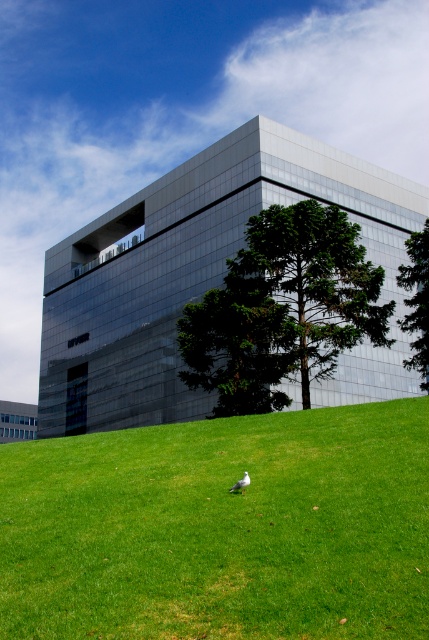
Is green grassy at lower center behind green leafy tree at center?

No, it is not.

Which is in front, point (311, 540) or point (326, 296)?

Point (311, 540) is in front.

Does point (145, 621) lie behind point (335, 285)?

No, (145, 621) is in front of (335, 285).

What are the coordinates of `green grassy at lower center` in the screenshot? It's located at click(221, 529).

Does green leafy tree at right appear over white matte bird at lower center?

Correct, green leafy tree at right is located above white matte bird at lower center.

At what (x,y) coordinates should I click in order to perform the action: click on green leafy tree at right. Please return your answer as a coordinate pair (x, y). The width and height of the screenshot is (429, 640). Looking at the image, I should click on (416, 301).

Does green grassy at lower center have a greater width compared to white matte bird at lower center?

Yes, green grassy at lower center is wider than white matte bird at lower center.

Between green grassy at lower center and white matte bird at lower center, which one is positioned lower?

green grassy at lower center is below.

Where is `green grassy at lower center`? Image resolution: width=429 pixels, height=640 pixels. green grassy at lower center is located at coordinates (221, 529).

The image size is (429, 640). Identify the location of green grassy at lower center. (221, 529).